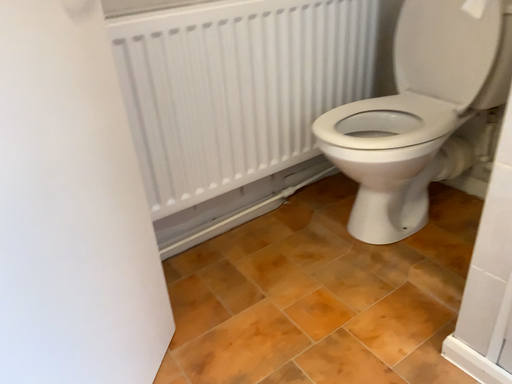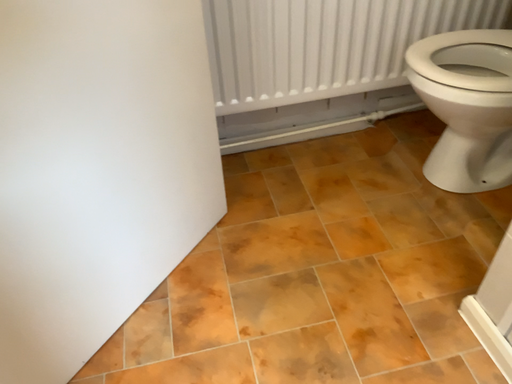
Question: How did the camera likely rotate when shooting the video?

Choices:
 (A) rotated right
 (B) rotated left

Answer: (B)